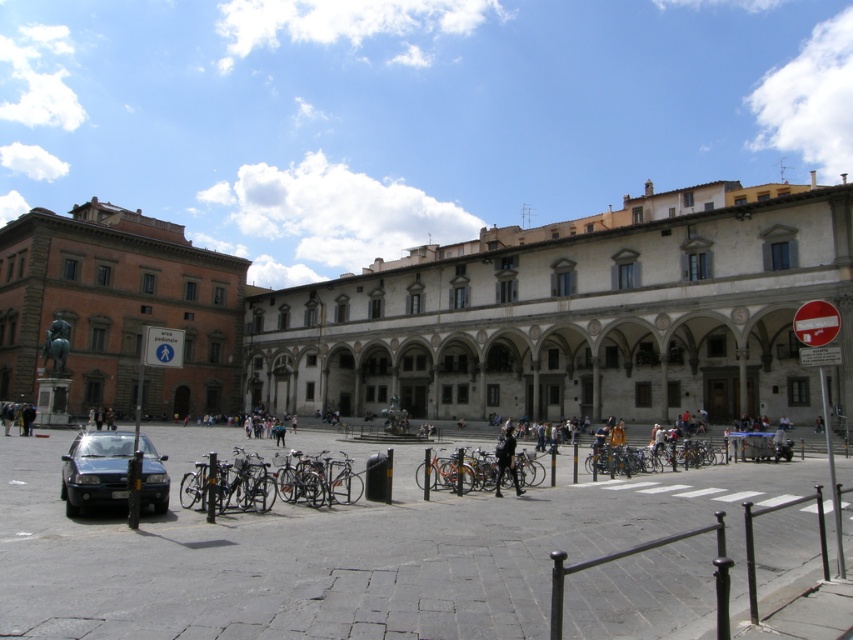
Question: Does matte brick building at left appear over orange matte bicycle at center?

Choices:
 (A) yes
 (B) no

Answer: (A)

Question: Does orange matte bicycle at center appear over dark blue uniform at center?

Choices:
 (A) no
 (B) yes

Answer: (A)

Question: Which object is positioned closest to the shiny black sedan at lower left?

Choices:
 (A) dark blue uniform at center
 (B) orange matte bicycle at center

Answer: (B)

Question: Which of the following is the farthest from the observer?

Choices:
 (A) orange matte bicycle at center
 (B) shiny black sedan at lower left

Answer: (A)

Question: Which object is positioned closest to the orange matte bicycle at center?

Choices:
 (A) matte stone building at center
 (B) shiny black sedan at lower left

Answer: (B)

Question: Can you confirm if matte brick building at left is wider than shiny black sedan at lower left?

Choices:
 (A) no
 (B) yes

Answer: (B)